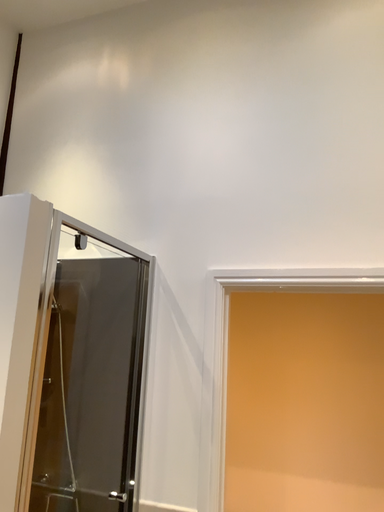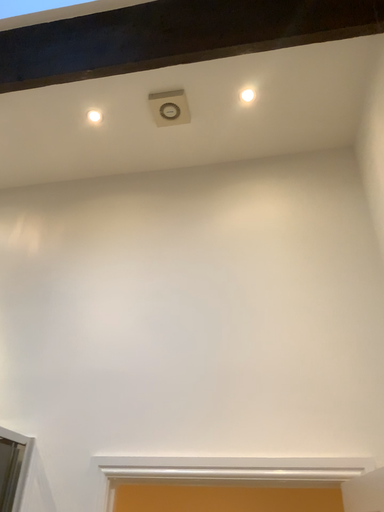
Question: Which way did the camera rotate in the video?

Choices:
 (A) rotated downward
 (B) rotated upward

Answer: (B)